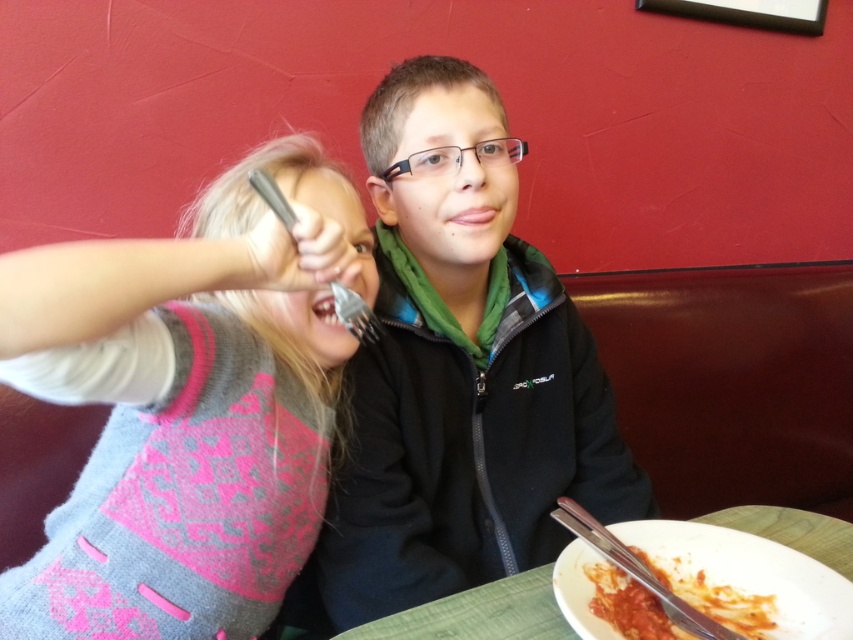
You are a waiter trying to place a new plate of food on the table between the black matte jacket at center and the tomato sauce pasta at lower right. Based on their sizes, can you fit the plate there?

The black matte jacket at center might be wider than the tomato sauce pasta at lower right, so there may not be enough space to place the plate between them.

You are a photographer setting up for a photo shoot. You need to position a light source to the left of the knitted sweater at left and another to the right of the black matte jacket at center. Will the light sources be placed in the same horizontal line?

The black matte jacket at center is to the right of the knitted sweater at left, so placing a light to the left of the knitted sweater at left and another to the right of the black matte jacket at center would mean the light sources are on opposite sides horizontally. Therefore, they will not be in the same horizontal line.